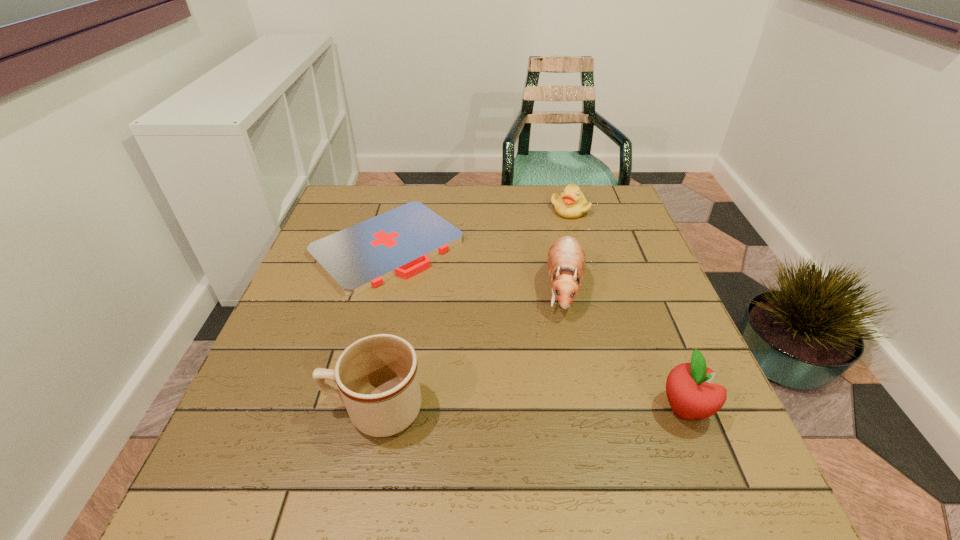
Find the location of a particular element. This screenshot has height=540, width=960. free space on the desktop that is between the mug and the apple and is positioned on handle side the shortest object is located at coordinates (576, 409).

The height and width of the screenshot is (540, 960). In order to click on free spot on the desktop that is between the mug and the apple and is positioned at the face of the duckling in this screenshot , I will do `click(559, 409)`.

The width and height of the screenshot is (960, 540). What are the coordinates of `vacant space on the desktop that is between the mug and the apple and is positioned at the face of the hamster` in the screenshot? It's located at (538, 409).